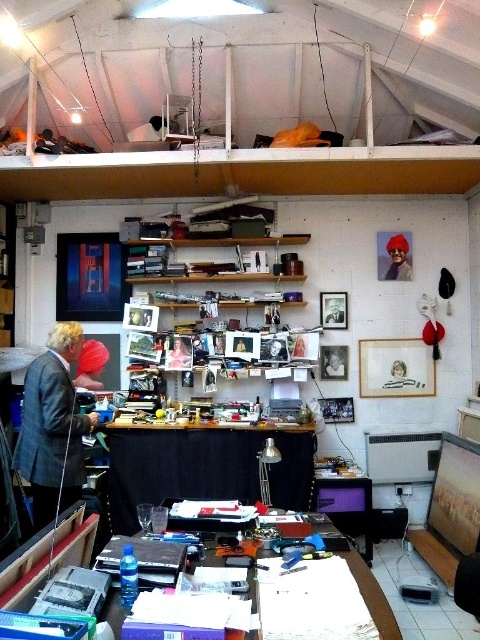
Question: Is matte black jacket at center to the right of smooth skin face at center from the viewer's perspective?

Choices:
 (A) no
 (B) yes

Answer: (B)

Question: Estimate the real-world distances between objects in this image. Which object is farther from the smooth skin portrait at center?

Choices:
 (A) matte red hat at upper right
 (B) gray wool suit at left
 (C) matte black laptop at upper left

Answer: (C)

Question: Does matte black jacket at center have a smaller size compared to smooth skin face at center?

Choices:
 (A) yes
 (B) no

Answer: (A)

Question: Does smooth skin portrait at center have a larger size compared to matte black laptop at upper left?

Choices:
 (A) no
 (B) yes

Answer: (A)

Question: Which point is farther to the camera?

Choices:
 (A) smooth skin face at center
 (B) matte black laptop at upper left

Answer: (A)

Question: Which object appears farthest from the camera in this image?

Choices:
 (A) smooth skin portrait at center
 (B) matte black jacket at center
 (C) light brown wooden frame at upper center

Answer: (B)